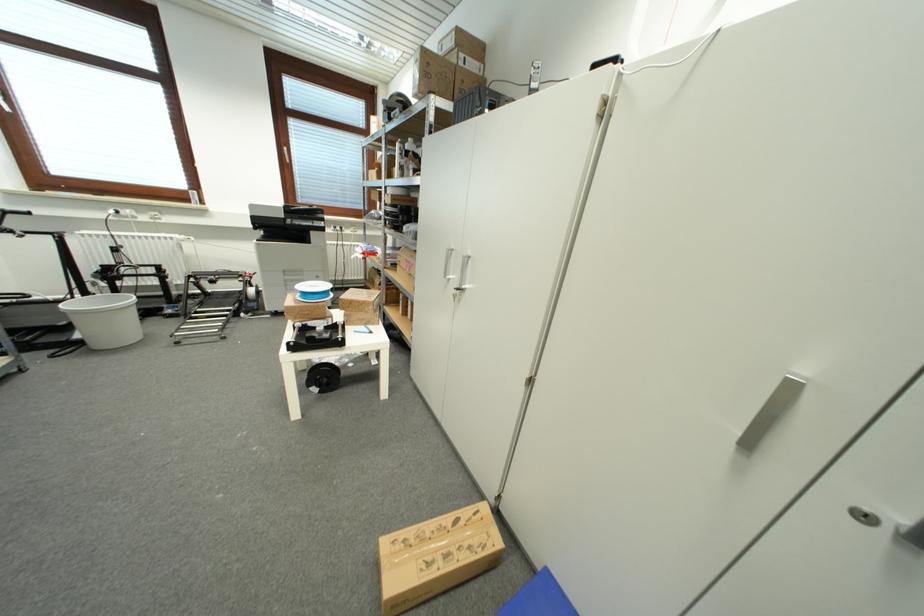
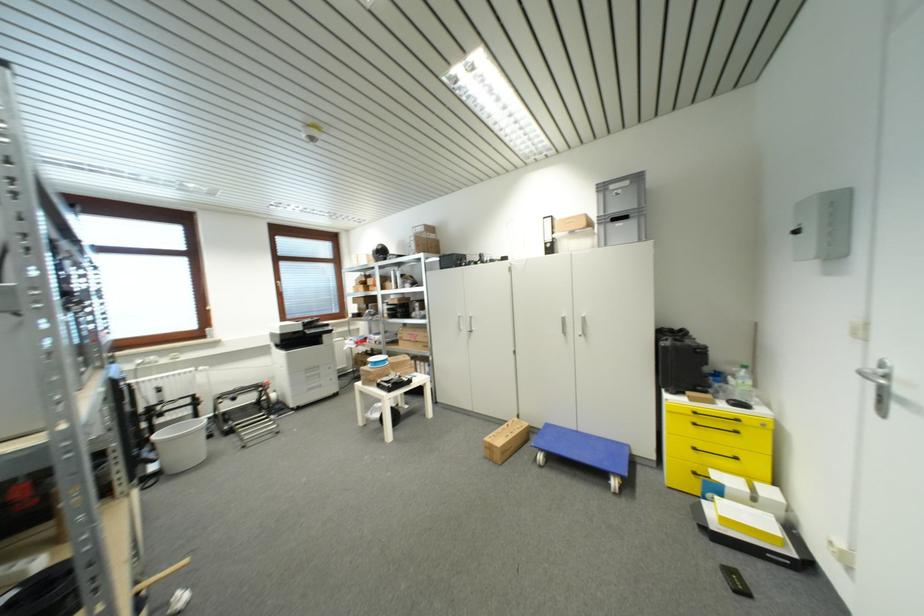
Where in the second image is the point corresponding to point 458,280 from the first image?

(468, 330)